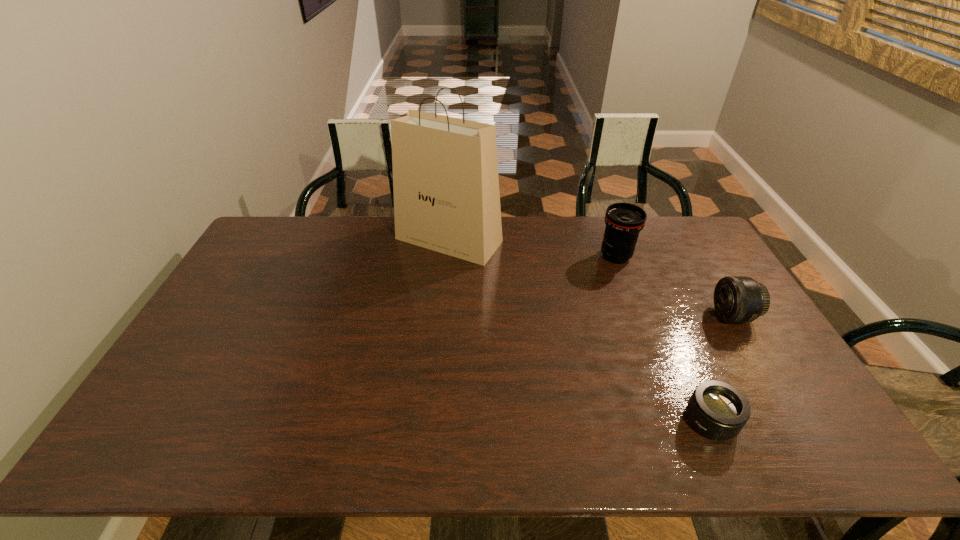
You are a GUI agent. You are given a task and a screenshot of the screen. Output one action in this format:
    pyautogui.click(x=<x>, y=<y>)
    Task: Click on the shopping bag
    This screenshot has width=960, height=540.
    Given the screenshot: What is the action you would take?
    pyautogui.click(x=446, y=192)

At what (x,y) coordinates should I click in order to perform the action: click on the leftmost object. Please return your answer as a coordinate pair (x, y). Looking at the image, I should click on coord(446,192).

Locate an element on the screen. the farthest telephoto lens is located at coordinates (624, 221).

You are a GUI agent. You are given a task and a screenshot of the screen. Output one action in this format:
    pyautogui.click(x=<x>, y=<y>)
    Task: Click on the third shortest object
    
    Given the screenshot: What is the action you would take?
    pyautogui.click(x=624, y=221)

The width and height of the screenshot is (960, 540). Find the location of `the second farthest telephoto lens`. the second farthest telephoto lens is located at coordinates point(738,299).

Find the location of a particular element. The height and width of the screenshot is (540, 960). the third tallest object is located at coordinates (738, 299).

Identify the location of the shortest object. This screenshot has height=540, width=960. (718, 410).

Locate an element on the screen. the nearest telephoto lens is located at coordinates (718, 410).

You are a GUI agent. You are given a task and a screenshot of the screen. Output one action in this format:
    pyautogui.click(x=<x>, y=<y>)
    Task: Click on the free space located 0.080m on the left of the tallest object
    The height and width of the screenshot is (540, 960).
    Given the screenshot: What is the action you would take?
    pyautogui.click(x=373, y=240)

Identify the location of vacant position located on the left of the farthest telephoto lens. (494, 256).